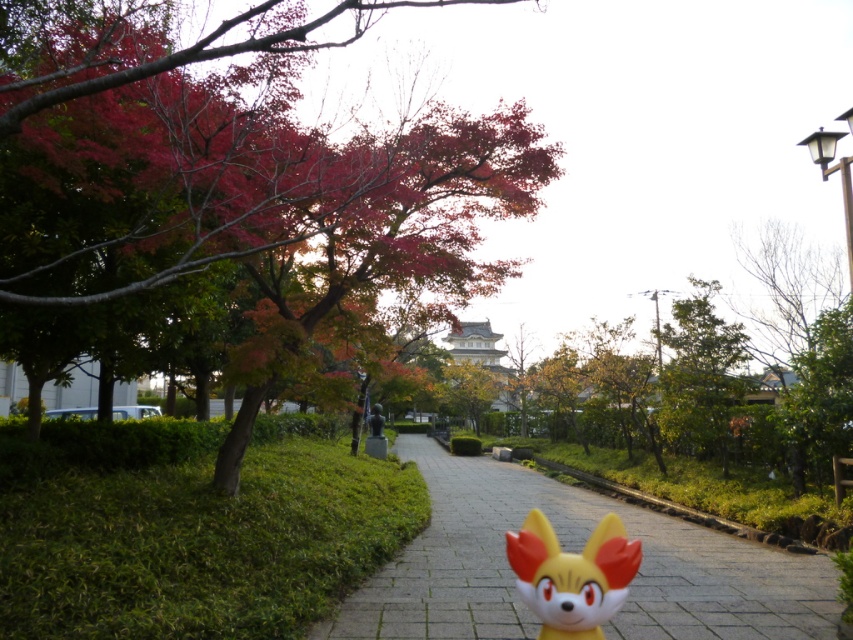
Who is higher up, reddish-brown bark tree at upper left or green leafy tree at upper right?

reddish-brown bark tree at upper left is above.

The height and width of the screenshot is (640, 853). I want to click on reddish-brown bark tree at upper left, so click(235, 170).

Can you confirm if plastic fox head at center is taller than green leafy tree at upper right?

No, plastic fox head at center is not taller than green leafy tree at upper right.

Based on the photo, between plastic fox head at center and green leafy tree at upper right, which one is positioned higher?

plastic fox head at center is higher up.

Is point (599, 544) positioned after point (722, 452)?

No, it is not.

Locate an element on the screen. The width and height of the screenshot is (853, 640). plastic fox head at center is located at coordinates 572,576.

Does paved stone path at center appear over plastic fox head at center?

No.

Between paved stone path at center and plastic fox head at center, which one is positioned higher?

plastic fox head at center is above.

You are a GUI agent. You are given a task and a screenshot of the screen. Output one action in this format:
    pyautogui.click(x=<x>, y=<y>)
    Task: Click on the paved stone path at center
    The height and width of the screenshot is (640, 853).
    Given the screenshot: What is the action you would take?
    pyautogui.click(x=575, y=548)